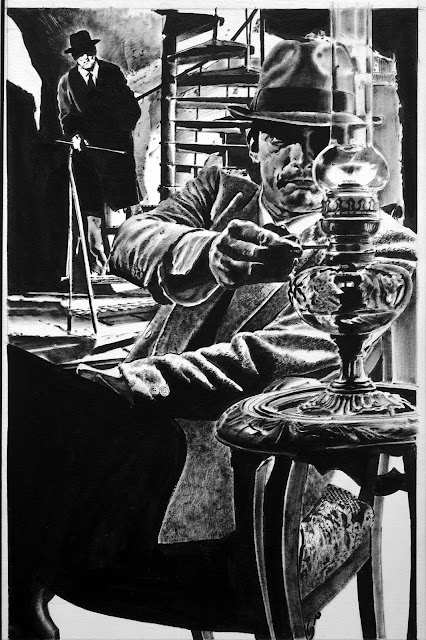
Locate an element on the screen. spiral staircase is located at coordinates (213, 68).